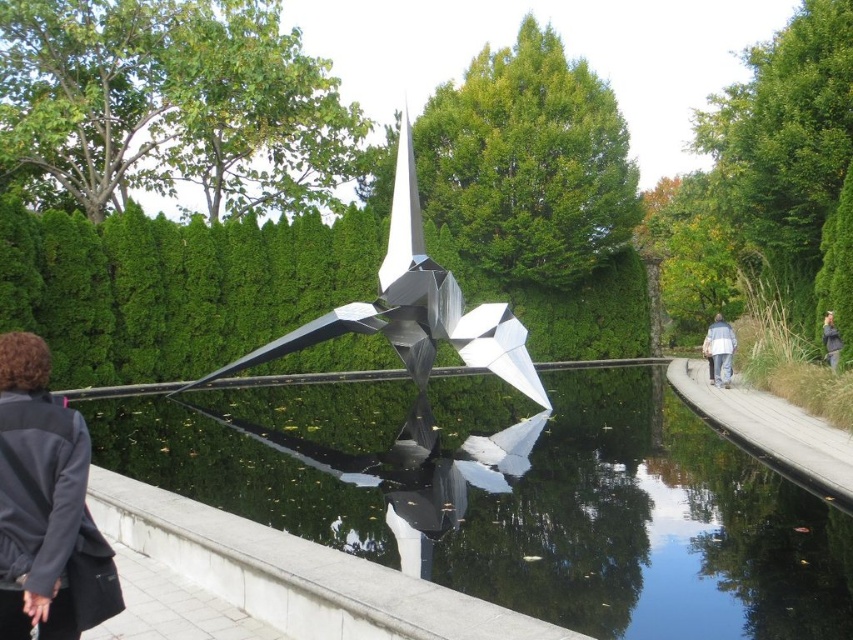
You are standing in the park and see the sculpture reflected in the water. You notice a point labeled as point (718, 349). Which object in the scene does this point belong to?

The point (718, 349) is on the white cotton jacket at right.

You are standing at the edge of the pond and want to place a new decorative item between the white cotton jacket at right and the gray fabric jacket at upper right. How far apart are these two jackets?

The white cotton jacket at right and gray fabric jacket at upper right are 5.14 feet apart from each other.